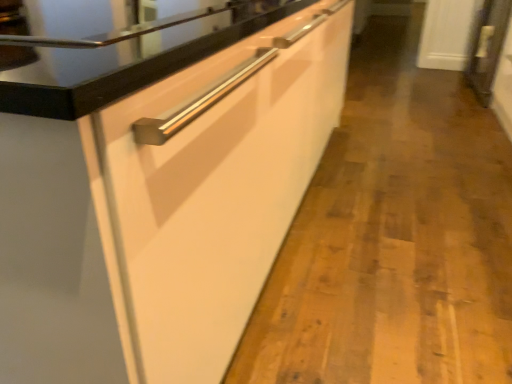
Where is `white glossy cabinet handle at center`? The height and width of the screenshot is (384, 512). white glossy cabinet handle at center is located at coordinates (159, 187).

Describe the element at coordinates (159, 187) in the screenshot. The image size is (512, 384). I see `white glossy cabinet handle at center` at that location.

Measure the distance between point (7, 291) and camera.

56.70 centimeters.

At what (x,y) coordinates should I click in order to perform the action: click on white glossy cabinet handle at center. Please return your answer as a coordinate pair (x, y). The height and width of the screenshot is (384, 512). Looking at the image, I should click on (159, 187).